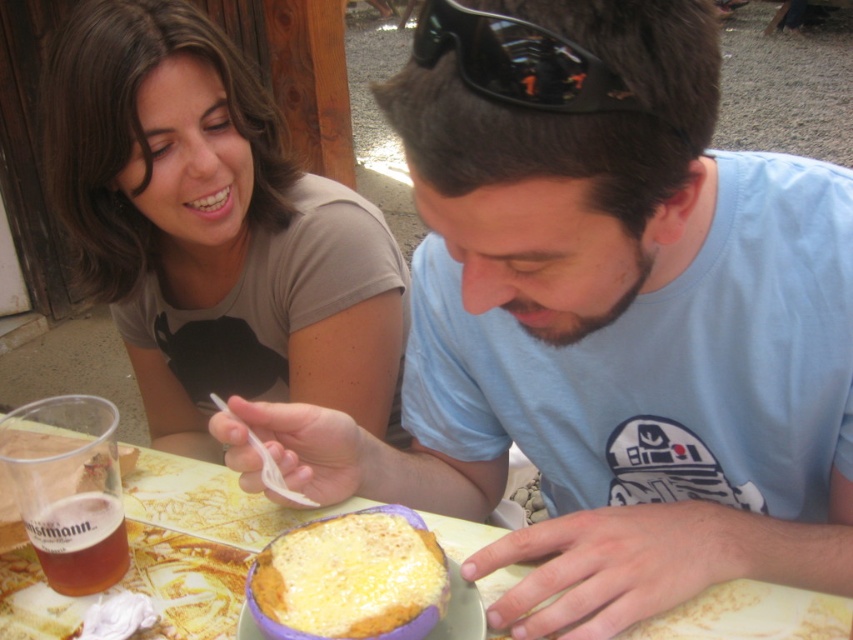
Does point (647, 632) lie in front of point (389, 572)?

No, it is behind (389, 572).

Which is more to the left, wooden table at center or golden cheese bread at center?

golden cheese bread at center is more to the left.

Does point (357, 508) come in front of point (326, 554)?

No.

At what (x,y) coordinates should I click in order to perform the action: click on wooden table at center. Please return your answer as a coordinate pair (x, y). Looking at the image, I should click on (209, 500).

Does matte brown shirt at upper left have a smaller size compared to translucent plastic cup at lower left?

Incorrect, matte brown shirt at upper left is not smaller in size than translucent plastic cup at lower left.

Does matte brown shirt at upper left appear over translucent plastic cup at lower left?

Indeed, matte brown shirt at upper left is positioned over translucent plastic cup at lower left.

Is point (177, 252) positioned behind point (48, 516)?

Yes.

Find the location of a particular element. This screenshot has height=640, width=853. matte brown shirt at upper left is located at coordinates (213, 228).

In the scene shown: Between golden cheese bread at center and black reflective sunglasses at upper center, which one is positioned lower?

Positioned lower is golden cheese bread at center.

Is golden cheese bread at center to the right of black reflective sunglasses at upper center from the viewer's perspective?

No, golden cheese bread at center is not to the right of black reflective sunglasses at upper center.

The width and height of the screenshot is (853, 640). What do you see at coordinates (350, 579) in the screenshot? I see `golden cheese bread at center` at bounding box center [350, 579].

Identify the location of golden cheese bread at center. The image size is (853, 640). (350, 579).